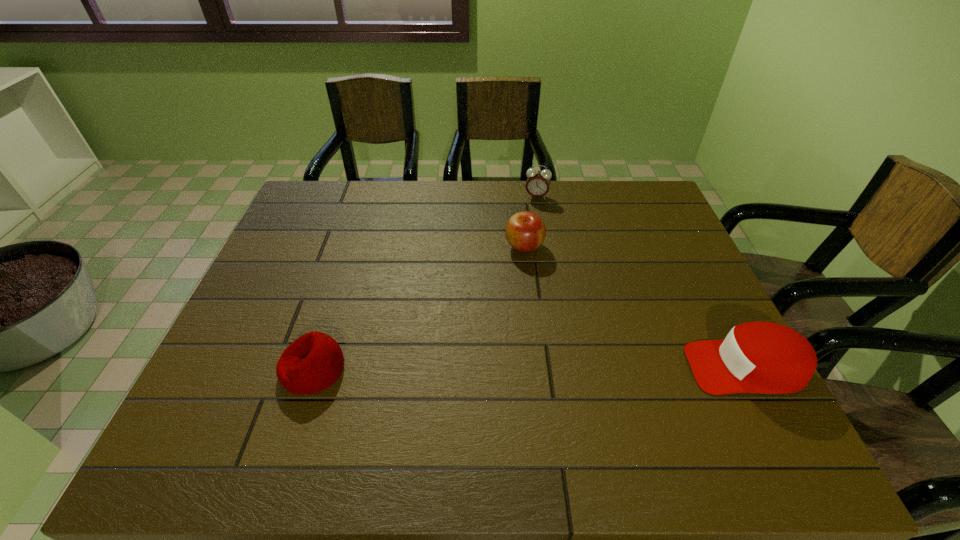
Where is `object at the right edge`? The image size is (960, 540). object at the right edge is located at coordinates (755, 357).

Find the location of `object that is at the near left corner`. object that is at the near left corner is located at coordinates (313, 362).

At what (x,y) coordinates should I click in order to perform the action: click on object positioned at the near right corner. Please return your answer as a coordinate pair (x, y). Looking at the image, I should click on (755, 357).

In the image, there is a desktop. Where is `vacant space at the far edge`? The image size is (960, 540). vacant space at the far edge is located at coordinates (373, 206).

You are a GUI agent. You are given a task and a screenshot of the screen. Output one action in this format:
    pyautogui.click(x=<x>, y=<y>)
    Task: Click on the free space at the near edge
    
    Given the screenshot: What is the action you would take?
    pyautogui.click(x=367, y=379)

I want to click on free spot at the left edge of the desktop, so click(300, 312).

In the image, there is a desktop. Find the location of `vacant space at the right edge`. vacant space at the right edge is located at coordinates (664, 284).

Identify the location of free spot between the baseball cap and the third nearest object. (635, 307).

The image size is (960, 540). Find the location of `vacant space that is in between the alarm clock and the rightmost object`. vacant space that is in between the alarm clock and the rightmost object is located at coordinates (641, 282).

Find the location of a particular element. The width and height of the screenshot is (960, 540). vacant space that is in between the farthest object and the beanbag is located at coordinates [x=424, y=283].